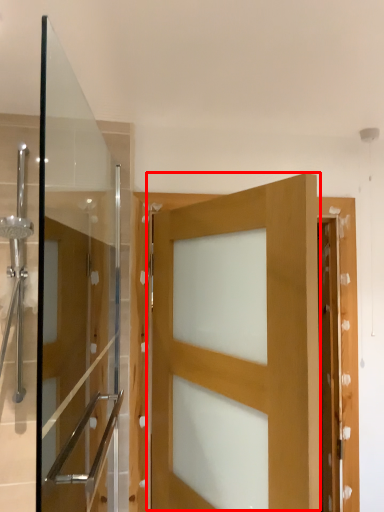
Question: From the image, what is the correct spatial relationship of door (annotated by the red box) in relation to screen door?

Choices:
 (A) left
 (B) right

Answer: (B)